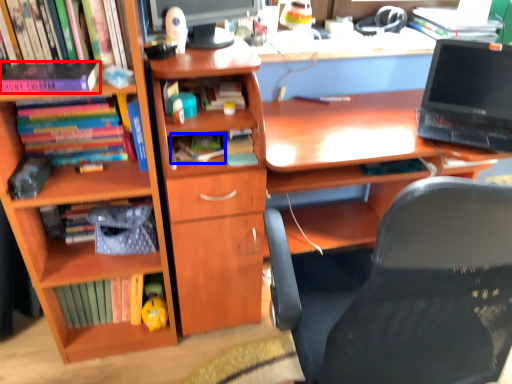
Question: Which object is further to the camera taking this photo, book (highlighted by a red box) or book (highlighted by a blue box)?

Choices:
 (A) book
 (B) book

Answer: (B)